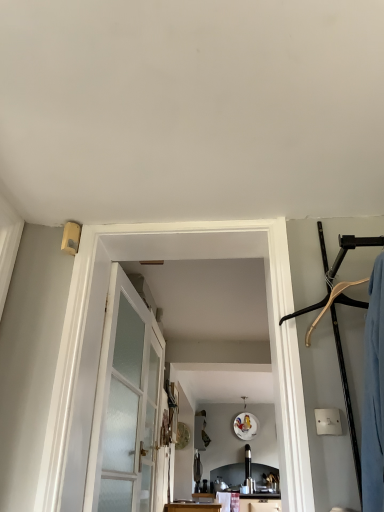
Question: In the image, is satin glass door at center positioned in front of or behind clear glass door at center?

Choices:
 (A) behind
 (B) front

Answer: (B)

Question: From the image's perspective, relative to clear glass door at center, is satin glass door at center above or below?

Choices:
 (A) above
 (B) below

Answer: (A)

Question: Which is farther from the clear glass door at center?

Choices:
 (A) white frosted glass barn door at center
 (B) satin glass door at center

Answer: (A)

Question: Which object is positioned farthest from the satin glass door at center?

Choices:
 (A) clear glass door at center
 (B) white frosted glass barn door at center

Answer: (B)